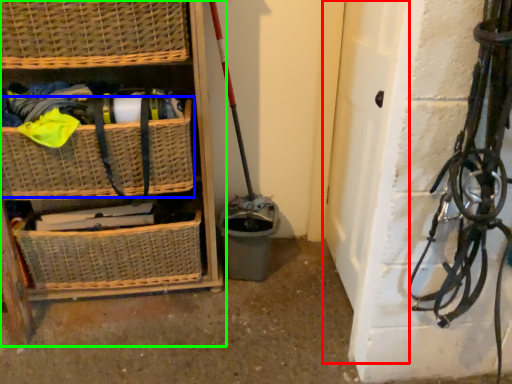
Question: Considering the real-world distances, which object is farthest from door (highlighted by a red box)? basket (highlighted by a blue box) or shelf (highlighted by a green box)?

Choices:
 (A) basket
 (B) shelf

Answer: (A)